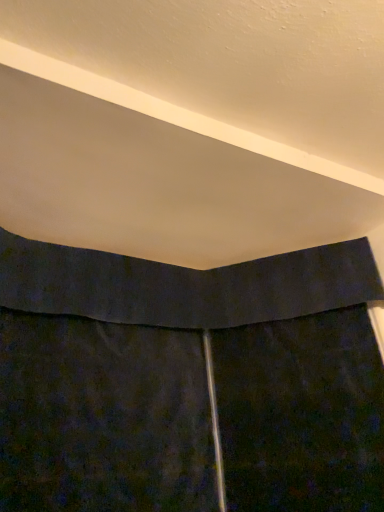
The width and height of the screenshot is (384, 512). Identify the location of dark fabric curtain at lower left. (189, 382).

The height and width of the screenshot is (512, 384). Describe the element at coordinates (189, 382) in the screenshot. I see `dark fabric curtain at lower left` at that location.

What is the approximate height of dark fabric curtain at lower left?

It is 4.48 feet.

The image size is (384, 512). Identify the location of dark fabric curtain at lower left. (189, 382).